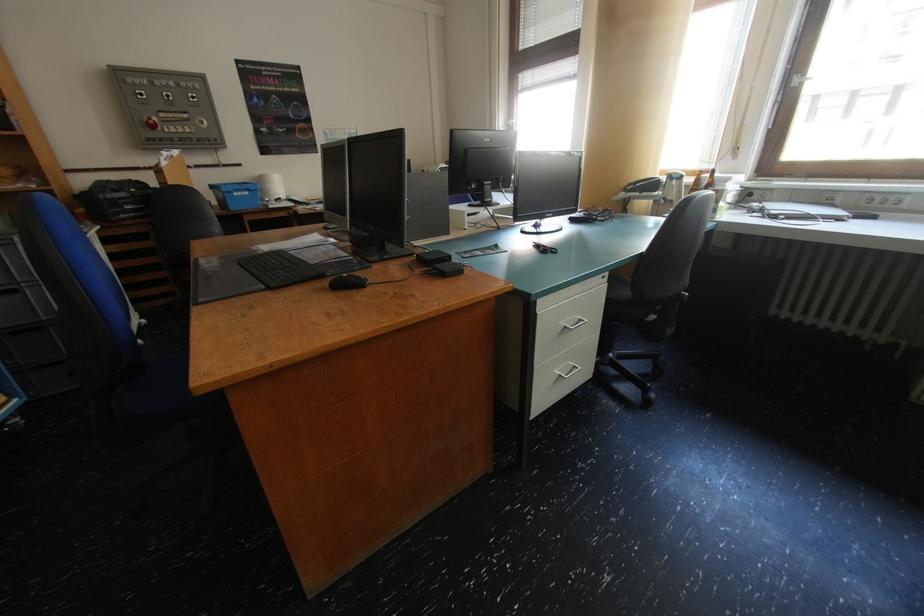
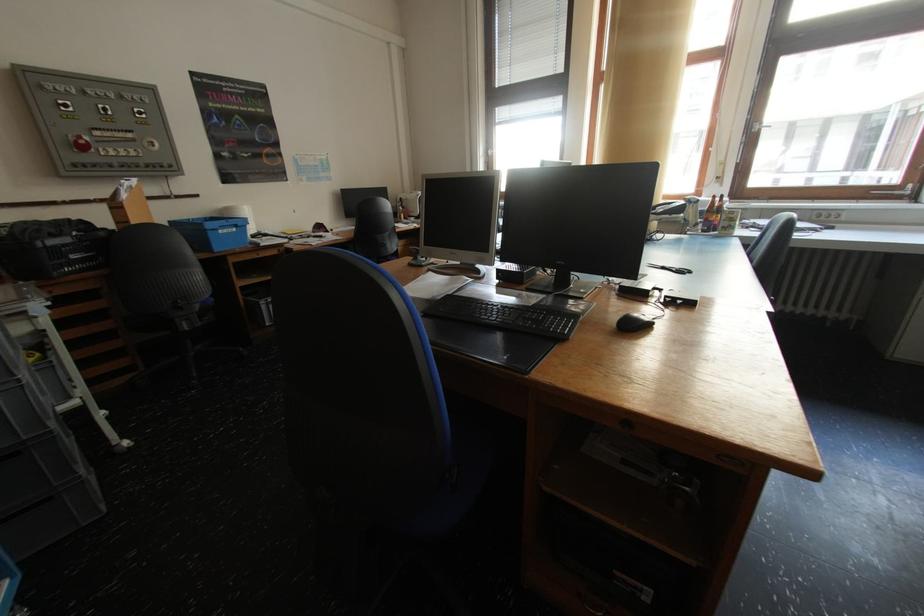
Find the pixel in the second image that matches (x=161, y=128) in the first image.

(91, 148)